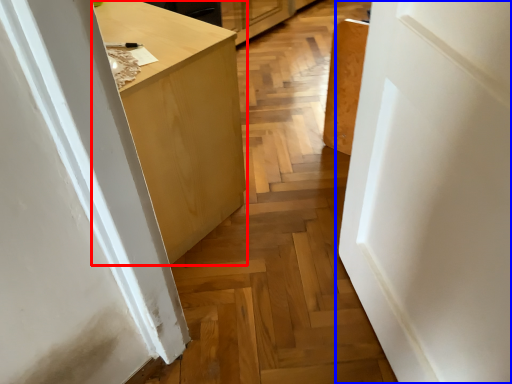
Question: Which of the following is the closest to the observer, cabinetry (highlighted by a red box) or door (highlighted by a blue box)?

Choices:
 (A) cabinetry
 (B) door

Answer: (B)